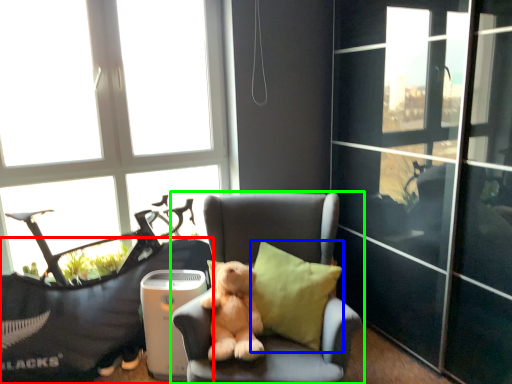
Question: Estimate the real-world distances between objects in this image. Which object is closer to furniture (highlighted by a red box), pillow (highlighted by a blue box) or chair (highlighted by a green box)?

Choices:
 (A) pillow
 (B) chair

Answer: (B)